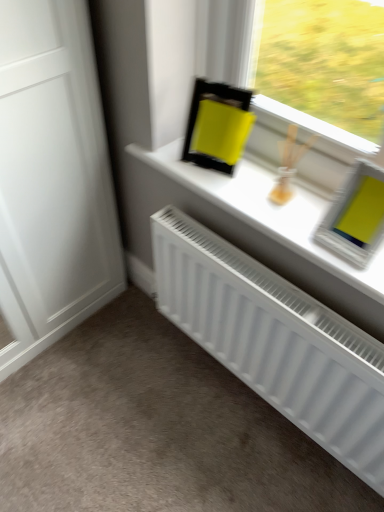
Where is `vacant region above white matte radiator at lower center (from a real-world perspective)`? vacant region above white matte radiator at lower center (from a real-world perspective) is located at coordinates (278, 285).